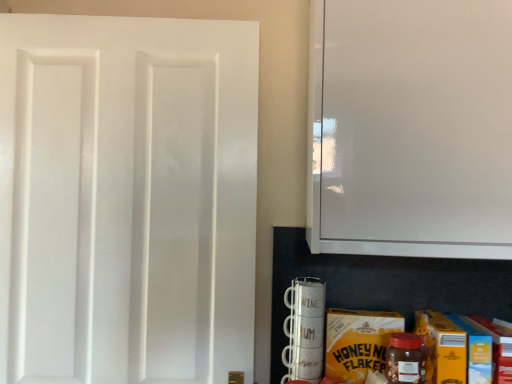
Question: From a real-world perspective, relative to translucent plastic jar at lower right, is yellow cardboard carton at lower right vertically above or below?

Choices:
 (A) above
 (B) below

Answer: (B)

Question: In terms of height, does yellow cardboard carton at lower right look taller or shorter compared to translucent plastic jar at lower right?

Choices:
 (A) tall
 (B) short

Answer: (A)

Question: Which of these objects is positioned farthest from the white matte door at left?

Choices:
 (A) white glossy cabinet at upper right
 (B) translucent plastic jar at lower right
 (C) yellow cardboard carton at lower right

Answer: (B)

Question: Based on their relative distances, which object is nearer to the white glossy cabinet at upper right?

Choices:
 (A) translucent plastic jar at lower right
 (B) yellow cardboard carton at lower right
 (C) white matte door at left

Answer: (B)